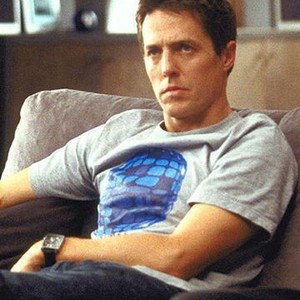
The height and width of the screenshot is (300, 300). In order to click on pictures in this screenshot , I will do `click(13, 27)`, `click(38, 24)`.